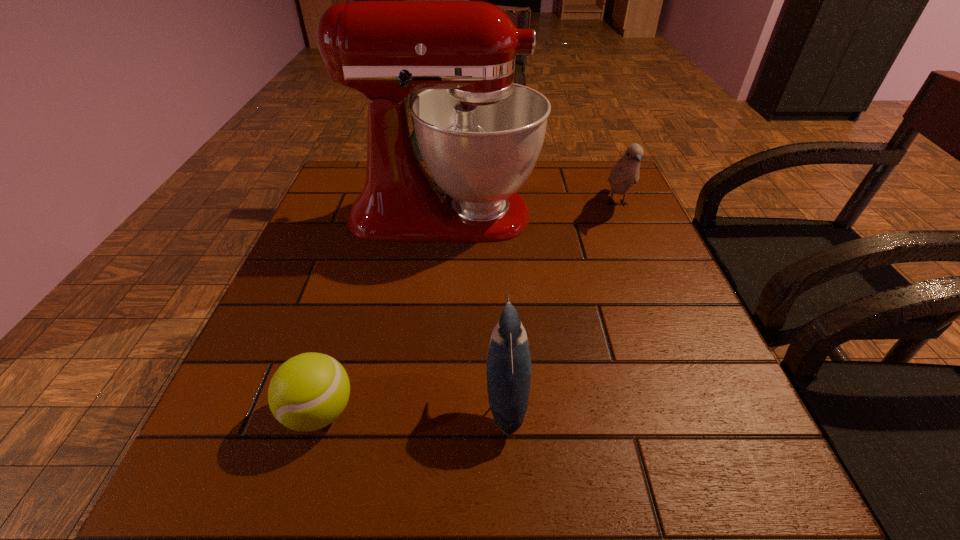
Locate an element on the screen. vacant region that satisfies the following two spatial constraints: 1. at the beak of the right bird; 2. at the tip of the left bird's beak is located at coordinates tap(699, 398).